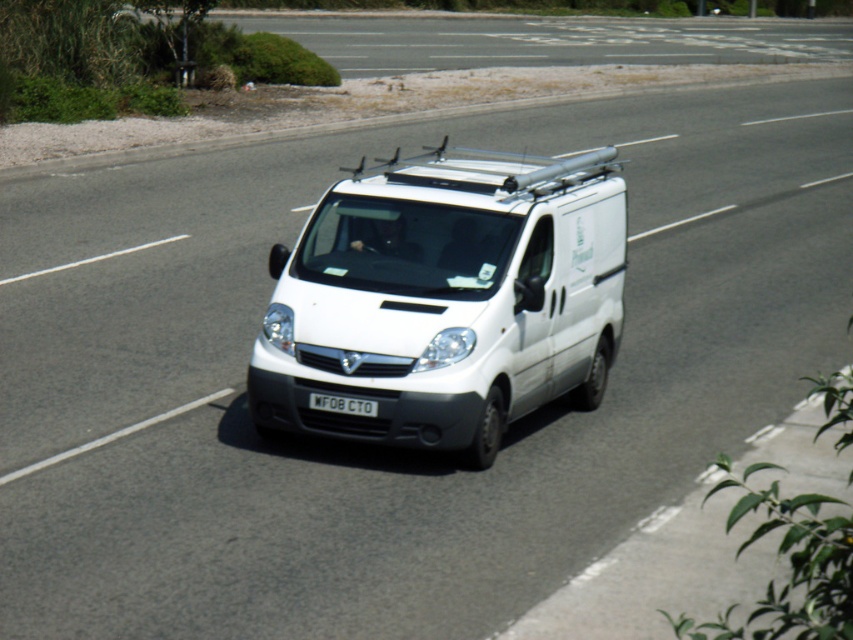
Can you confirm if white matte van at center is wider than black plastic license plate at center?

Yes.

Is white matte van at center to the right of black plastic license plate at center from the viewer's perspective?

Indeed, white matte van at center is positioned on the right side of black plastic license plate at center.

Is point (524, 340) positioned behind point (341, 408)?

Yes, point (524, 340) is behind point (341, 408).

The image size is (853, 640). Find the location of `white matte van at center`. white matte van at center is located at coordinates (445, 298).